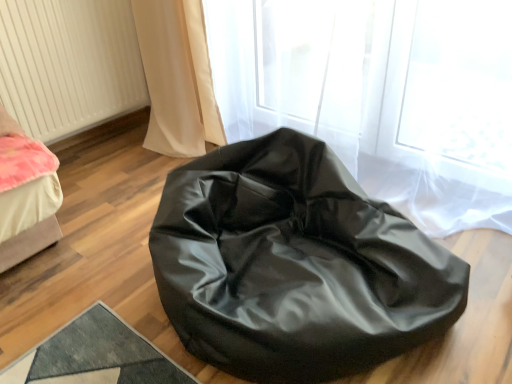
Question: Is white textured radiator at left taller or shorter than glossy black bean bag at center?

Choices:
 (A) tall
 (B) short

Answer: (A)

Question: From the image's perspective, is white textured radiator at left located above or below glossy black bean bag at center?

Choices:
 (A) above
 (B) below

Answer: (A)

Question: In terms of size, does white textured radiator at left appear bigger or smaller than glossy black bean bag at center?

Choices:
 (A) big
 (B) small

Answer: (B)

Question: Choose the correct answer: Is glossy black bean bag at center inside white textured radiator at left or outside it?

Choices:
 (A) outside
 (B) inside

Answer: (A)

Question: In terms of height, does glossy black bean bag at center look taller or shorter compared to white textured radiator at left?

Choices:
 (A) short
 (B) tall

Answer: (A)

Question: From a real-world perspective, is glossy black bean bag at center physically located above or below white textured radiator at left?

Choices:
 (A) above
 (B) below

Answer: (B)

Question: In the image, is glossy black bean bag at center on the left side or the right side of white textured radiator at left?

Choices:
 (A) left
 (B) right

Answer: (B)